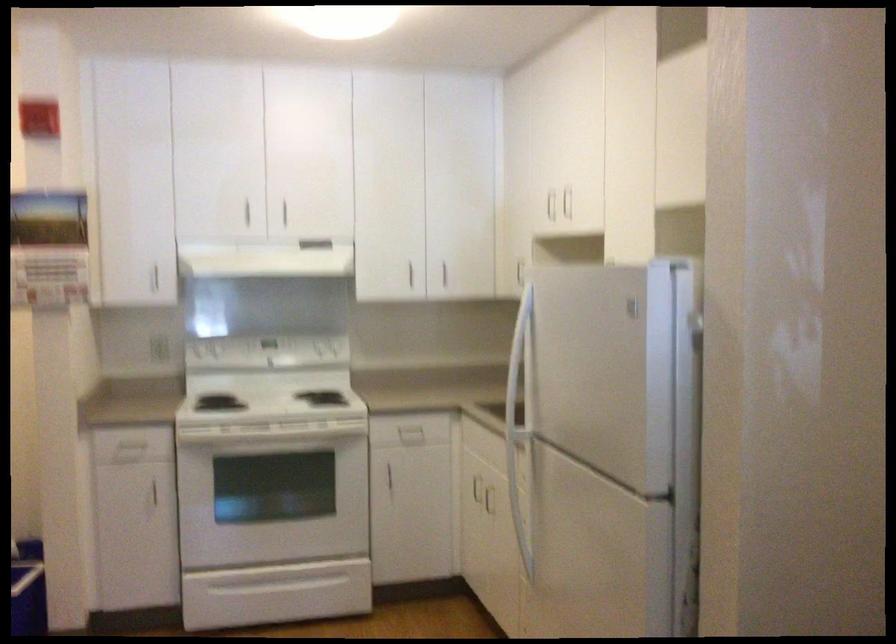
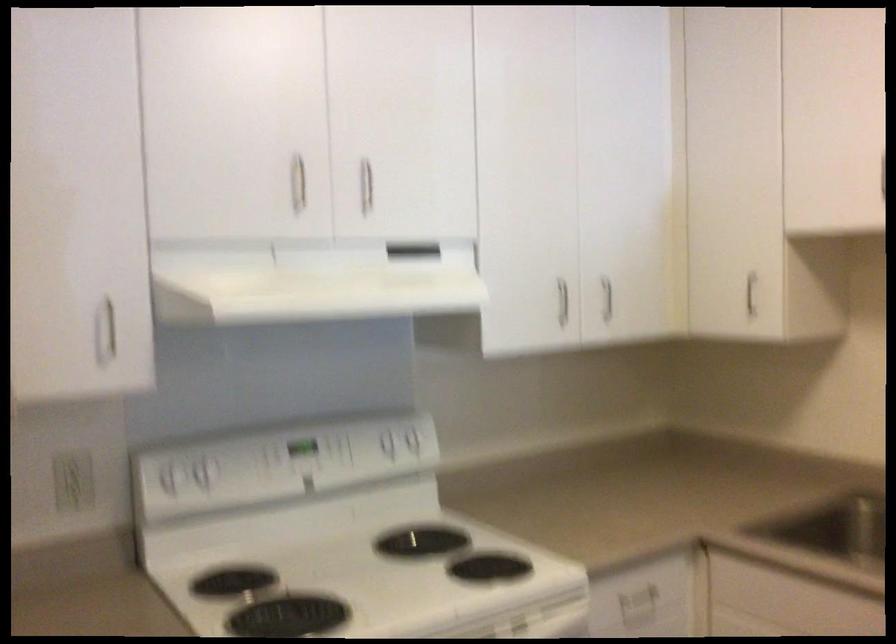
The point at (444, 269) is marked in the first image. Where is the corresponding point in the second image?

(607, 298)